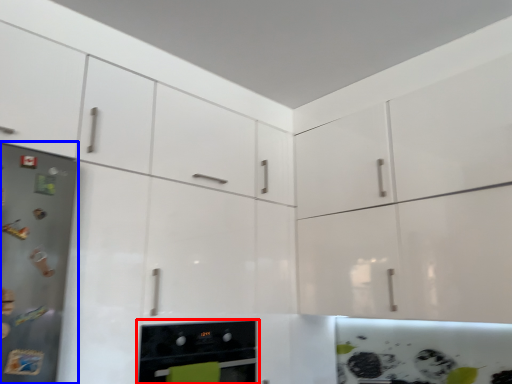
Question: Which object is further to the camera taking this photo, home appliance (highlighted by a red box) or appliance (highlighted by a blue box)?

Choices:
 (A) home appliance
 (B) appliance

Answer: (A)